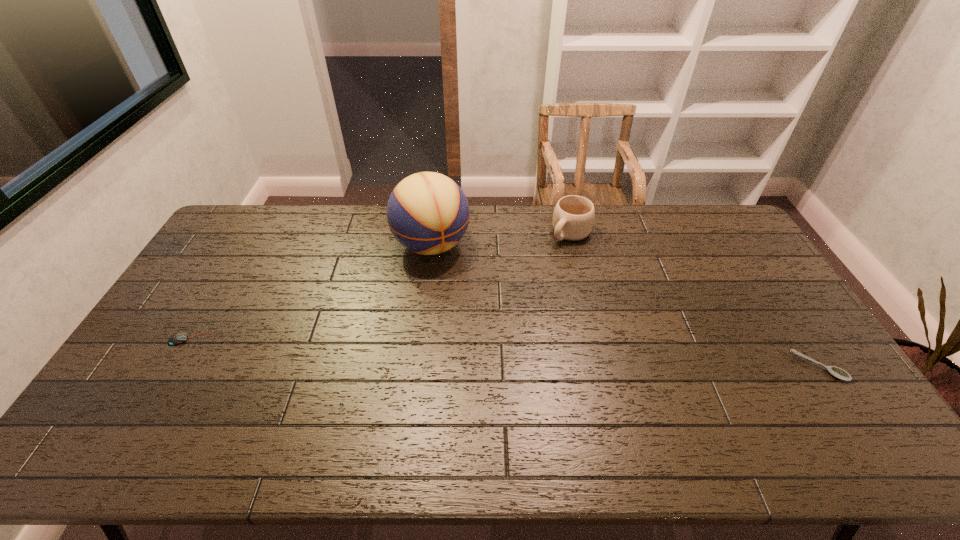
Where is `the third farthest object`? This screenshot has width=960, height=540. the third farthest object is located at coordinates (178, 338).

The height and width of the screenshot is (540, 960). In order to click on mouse in this screenshot , I will do `click(178, 338)`.

You are a GUI agent. You are given a task and a screenshot of the screen. Output one action in this format:
    pyautogui.click(x=<x>, y=<y>)
    Task: Click on the nearest object
    
    Given the screenshot: What is the action you would take?
    pyautogui.click(x=837, y=372)

The height and width of the screenshot is (540, 960). Find the location of `soupspoon`. soupspoon is located at coordinates (837, 372).

Where is `basketball`? basketball is located at coordinates (428, 213).

The image size is (960, 540). In order to click on the tallest object in this screenshot , I will do `click(428, 213)`.

At what (x,y) coordinates should I click in order to perform the action: click on mug. Please return your answer as a coordinate pair (x, y). Looking at the image, I should click on (573, 218).

This screenshot has height=540, width=960. What are the coordinates of `the second object from right to left` in the screenshot? It's located at (573, 218).

Identify the location of free location located on the right of the mouse. The height and width of the screenshot is (540, 960). (278, 339).

Identify the location of free spot located on the back of the nearest object. The width and height of the screenshot is (960, 540). (770, 294).